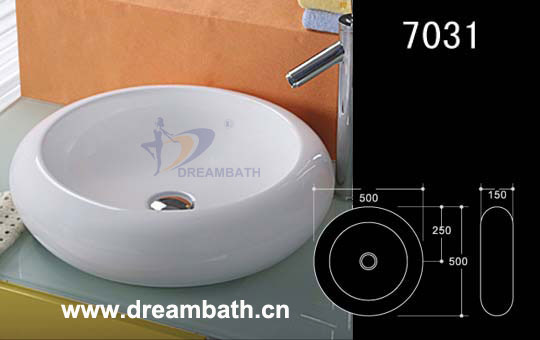
Locate an element on the screen. The width and height of the screenshot is (540, 340). glass is located at coordinates (67, 281).